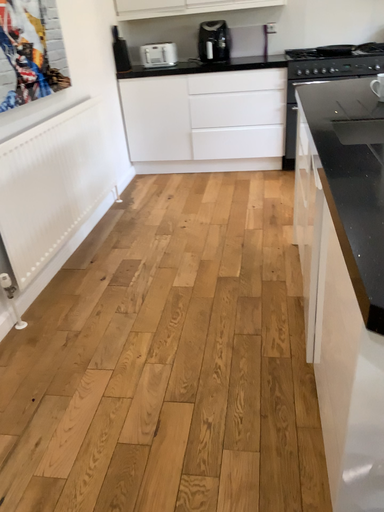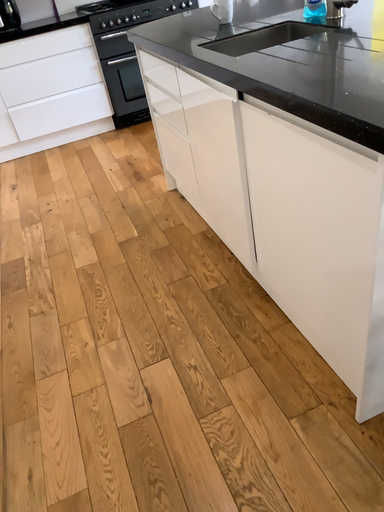
Question: Which way did the camera rotate in the video?

Choices:
 (A) rotated left
 (B) rotated right

Answer: (B)